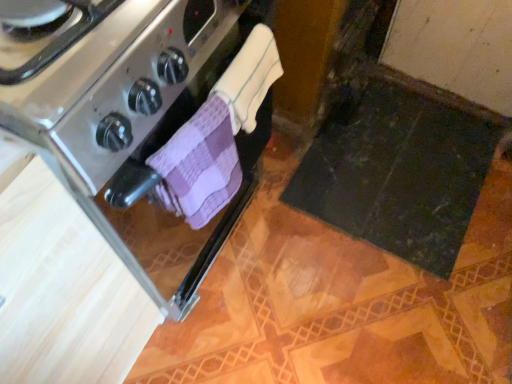
Question: Is white terry cloth towel at center, which is counted as the 1th bath towel, starting from the top, at the left side of stainless steel oven at left?

Choices:
 (A) no
 (B) yes

Answer: (A)

Question: Is white terry cloth towel at center, which is counted as the 1th bath towel, starting from the top, shorter than stainless steel oven at left?

Choices:
 (A) yes
 (B) no

Answer: (A)

Question: Is white terry cloth towel at center, which is counted as the 1th bath towel, starting from the top, behind stainless steel oven at left?

Choices:
 (A) yes
 (B) no

Answer: (A)

Question: From a real-world perspective, is white terry cloth towel at center, which is counted as the 1th bath towel, starting from the top, located higher than stainless steel oven at left?

Choices:
 (A) yes
 (B) no

Answer: (A)

Question: From a real-world perspective, is white terry cloth towel at center, the 2th bath towel from the bottom, positioned under stainless steel oven at left based on gravity?

Choices:
 (A) no
 (B) yes

Answer: (A)

Question: Looking at their shapes, would you say purple checkered cloth at center, placed as the second bath towel when sorted from top to bottom, is wider or thinner than stainless steel oven at left?

Choices:
 (A) thin
 (B) wide

Answer: (A)

Question: From the image's perspective, is purple checkered cloth at center, placed as the second bath towel when sorted from top to bottom, positioned above or below stainless steel oven at left?

Choices:
 (A) below
 (B) above

Answer: (A)

Question: From a real-world perspective, is purple checkered cloth at center, marked as the 1th bath towel in a bottom-to-top arrangement, physically located above or below stainless steel oven at left?

Choices:
 (A) above
 (B) below

Answer: (A)

Question: Visually, is purple checkered cloth at center, placed as the second bath towel when sorted from top to bottom, positioned to the left or to the right of stainless steel oven at left?

Choices:
 (A) left
 (B) right

Answer: (B)

Question: Is white terry cloth towel at center, the 2th bath towel from the bottom, taller or shorter than purple checkered cloth at center, marked as the 1th bath towel in a bottom-to-top arrangement?

Choices:
 (A) short
 (B) tall

Answer: (A)

Question: Is white terry cloth towel at center, the 2th bath towel from the bottom, wider or thinner than purple checkered cloth at center, placed as the second bath towel when sorted from top to bottom?

Choices:
 (A) wide
 (B) thin

Answer: (B)

Question: Is white terry cloth towel at center, the 2th bath towel from the bottom, inside or outside of purple checkered cloth at center, marked as the 1th bath towel in a bottom-to-top arrangement?

Choices:
 (A) inside
 (B) outside

Answer: (B)

Question: From a real-world perspective, is white terry cloth towel at center, the 2th bath towel from the bottom, physically located above or below purple checkered cloth at center, marked as the 1th bath towel in a bottom-to-top arrangement?

Choices:
 (A) above
 (B) below

Answer: (A)

Question: Is point (164, 127) positioned closer to the camera than point (266, 87)?

Choices:
 (A) closer
 (B) farther

Answer: (A)

Question: In terms of height, does stainless steel oven at left look taller or shorter compared to white terry cloth towel at center, which is counted as the 1th bath towel, starting from the top?

Choices:
 (A) short
 (B) tall

Answer: (B)